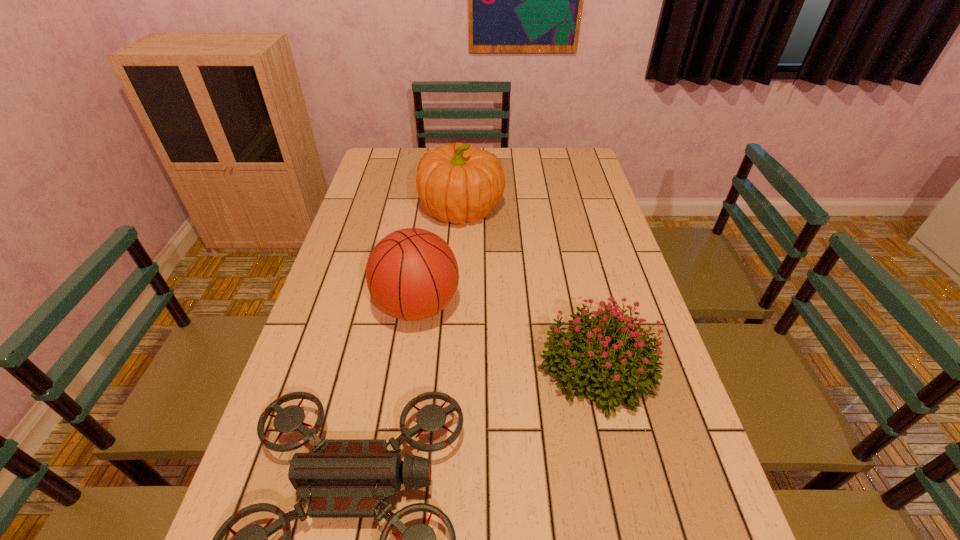
Locate an element on the screen. The image size is (960, 540). free region at the right edge is located at coordinates (623, 425).

Find the location of `vacant space at the far left corner`. vacant space at the far left corner is located at coordinates (401, 151).

Identify the location of empty location between the farthest object and the bouquet. This screenshot has height=540, width=960. (529, 289).

Find the location of `free spot between the basketball and the bouquet`. free spot between the basketball and the bouquet is located at coordinates (507, 338).

Image resolution: width=960 pixels, height=540 pixels. I want to click on object that can be found as the second closest to the drone, so click(412, 274).

Identify the location of object that can be found as the closest to the rightmost object. This screenshot has height=540, width=960. (348, 478).

Find the location of a particular element. free location that satisfies the following two spatial constraints: 1. on the front side of the basketball; 2. on the left side of the bouquet is located at coordinates (409, 368).

Identify the location of vacant space that satisfies the following two spatial constraints: 1. on the front side of the bouquet; 2. on the right side of the basketball. (409, 368).

Find the location of a particular element. vacant region that satisfies the following two spatial constraints: 1. on the surface of the bouquet; 2. on the left side of the pumpkin is located at coordinates (453, 368).

Image resolution: width=960 pixels, height=540 pixels. What are the coordinates of `vacant position in the image that satisfies the following two spatial constraints: 1. on the surface of the rightmost object; 2. on the right side of the pumpkin` in the screenshot? It's located at (453, 368).